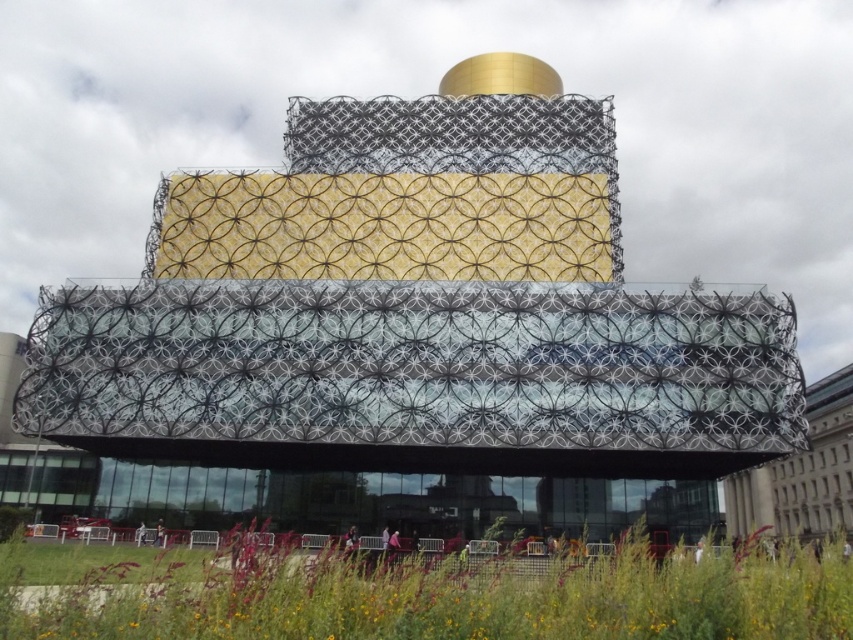
Which is below, translucent glass facade at center or green grass at lower center?

green grass at lower center is lower down.

The height and width of the screenshot is (640, 853). What do you see at coordinates (415, 365) in the screenshot?
I see `translucent glass facade at center` at bounding box center [415, 365].

Locate an element on the screen. translucent glass facade at center is located at coordinates (415, 365).